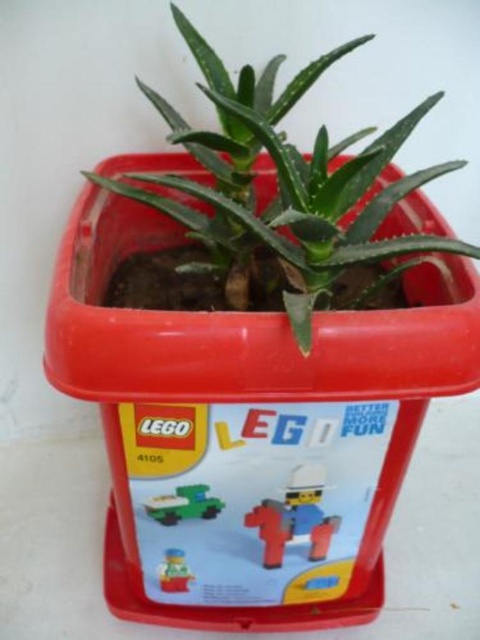
You are a gardener who wants to water the green matte plant at center and the green matte toy car at center. Since both are in the same container, which one needs to be watered more frequently?

The green matte plant at center needs to be watered more frequently because it is taller than the green matte toy car at center and requires more moisture to sustain its growth.

In the scene shown: You are a gardener who wants to water the green matte plant at center and the matte plastic cowboy at center. Which one should you water first to avoid damaging the cowboy?

You should water the green matte plant at center first because it is positioned over the matte plastic cowboy at center, so watering the plant first will prevent water from dripping onto the cowboy and potentially damaging it.

You are standing in front of the LEGO storage bin turned planter. There are two points marked on the bin. One is at coordinate point (392,128) and the other is at point (146,502). Which point is closer to you?

Point (392,128) is closer to you because it is further to the viewer than point (146,502).